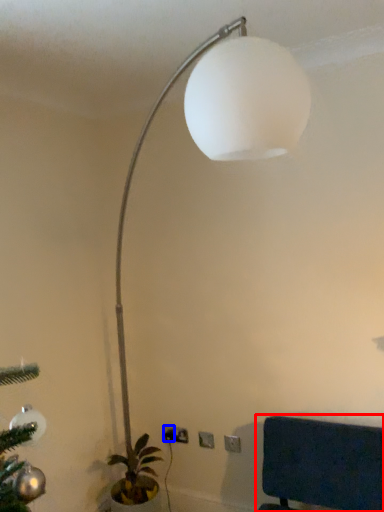
Question: Which of the following is the farthest to the observer, furniture (highlighted by a red box) or electric outlet (highlighted by a blue box)?

Choices:
 (A) furniture
 (B) electric outlet

Answer: (B)